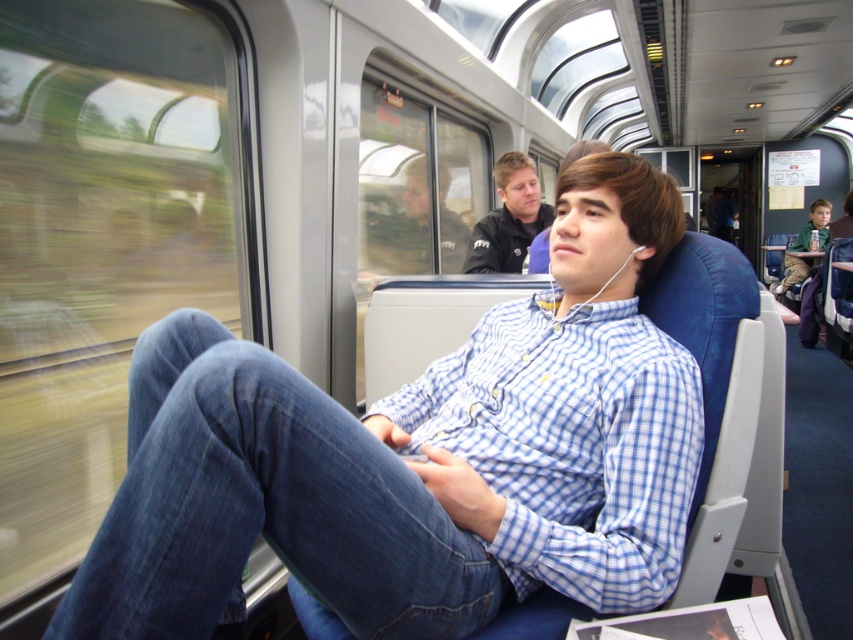
Question: Which of the following is the farthest from the observer?

Choices:
 (A) (431, 211)
 (B) (218, 348)

Answer: (A)

Question: Considering the relative positions of denim at left and matte black jacket at center in the image provided, where is denim at left located with respect to matte black jacket at center?

Choices:
 (A) below
 (B) above

Answer: (A)

Question: Is denim at left positioned behind matte black jacket at center?

Choices:
 (A) yes
 (B) no

Answer: (B)

Question: Which object is farther from the camera taking this photo?

Choices:
 (A) dark blue jacket at upper center
 (B) denim at left

Answer: (A)

Question: Can you confirm if denim at left is bigger than dark blue jacket at upper center?

Choices:
 (A) yes
 (B) no

Answer: (B)

Question: Estimate the real-world distances between objects in this image. Which object is farther from the denim at left?

Choices:
 (A) dark blue jacket at upper center
 (B) matte black jacket at center

Answer: (B)